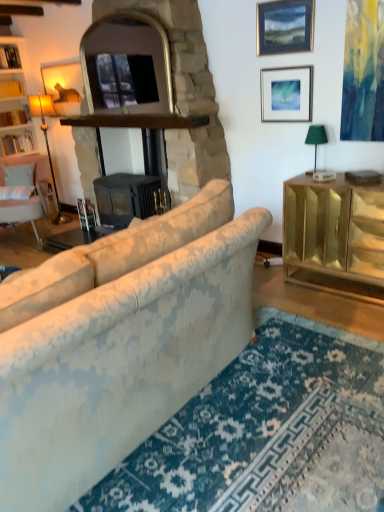
I want to click on light pink fabric chair at left, so click(x=30, y=197).

The width and height of the screenshot is (384, 512). Describe the element at coordinates (315, 141) in the screenshot. I see `green fabric lampshade at right, marked as the 1th lamp in a right-to-left arrangement` at that location.

I want to click on matte gold floor lamp at left, placed as the first lamp when sorted from back to front, so click(47, 145).

What do you see at coordinates (134, 122) in the screenshot?
I see `black matte fireplace at center, the second fireplace from the left` at bounding box center [134, 122].

The image size is (384, 512). What are the coordinates of `gold mirrored cabinet at right` in the screenshot? It's located at (334, 236).

Can you confirm if matte gold floor lamp at left, arranged as the 2th lamp when viewed from the front, is bigger than matte black picture frame at upper center, which ranks as the second picture frame in bottom-to-top order?

Yes.

Consider the image. Between matte gold floor lamp at left, the first lamp from the left, and matte black picture frame at upper center, which is counted as the first picture frame, starting from the top, which one appears on the left side from the viewer's perspective?

Positioned to the left is matte gold floor lamp at left, the first lamp from the left.

From a real-world perspective, which object rests below the other?

matte gold floor lamp at left, placed as the first lamp when sorted from back to front, from a real-world perspective.

In terms of height, does matte gold floor lamp at left, arranged as the 2th lamp when viewed from the front, look taller or shorter compared to matte black picture frame at upper center, which is counted as the first picture frame, starting from the top?

Considering their sizes, matte gold floor lamp at left, arranged as the 2th lamp when viewed from the front, has more height than matte black picture frame at upper center, which is counted as the first picture frame, starting from the top.

Considering the sizes of objects white wood bookshelf at left and stone fireplace at center, acting as the first fireplace starting from the left, in the image provided, who is taller, white wood bookshelf at left or stone fireplace at center, acting as the first fireplace starting from the left,?

Standing taller between the two is stone fireplace at center, acting as the first fireplace starting from the left.

Does white wood bookshelf at left touch stone fireplace at center, acting as the 2th fireplace starting from the right?

No, white wood bookshelf at left is not beside stone fireplace at center, acting as the 2th fireplace starting from the right.

Locate an element on the screen. This screenshot has height=512, width=384. fireplace that is the 2nd one when counting forward from the white wood bookshelf at left is located at coordinates (184, 93).

From the picture: Considering the sizes of objects white wood bookshelf at left and stone fireplace at center, acting as the 2th fireplace starting from the right, in the image provided, who is wider, white wood bookshelf at left or stone fireplace at center, acting as the 2th fireplace starting from the right,?

Wider between the two is stone fireplace at center, acting as the 2th fireplace starting from the right.

From the image's perspective, between gold mirrored cabinet at right and matte gold floor lamp at left, placed as the first lamp when sorted from back to front, who is located below?

gold mirrored cabinet at right, from the image's perspective.

From a real-world perspective, is gold mirrored cabinet at right over matte gold floor lamp at left, placed as the first lamp when sorted from back to front?

No, from a real-world perspective, gold mirrored cabinet at right is not on top of matte gold floor lamp at left, placed as the first lamp when sorted from back to front.

Considering the positions of objects gold mirrored cabinet at right and matte gold floor lamp at left, placed as the first lamp when sorted from back to front, in the image provided, who is more to the left, gold mirrored cabinet at right or matte gold floor lamp at left, placed as the first lamp when sorted from back to front,?

Positioned to the left is matte gold floor lamp at left, placed as the first lamp when sorted from back to front.

Where is `shelf that is under the silver metallic picture frame at upper right, positioned as the 2th picture frame in top-to-bottom order (from a real-world perspective)`? Image resolution: width=384 pixels, height=512 pixels. shelf that is under the silver metallic picture frame at upper right, positioned as the 2th picture frame in top-to-bottom order (from a real-world perspective) is located at coordinates (16, 141).

Is silver metallic picture frame at upper right, acting as the 1th picture frame starting from the bottom, completely or partially inside white wood bookshelf at left?

Definitely not — silver metallic picture frame at upper right, acting as the 1th picture frame starting from the bottom, is not inside white wood bookshelf at left.

From a real-world perspective, who is located higher, white wood bookshelf at left or silver metallic picture frame at upper right, acting as the 1th picture frame starting from the bottom?

In real-world perspective, silver metallic picture frame at upper right, acting as the 1th picture frame starting from the bottom, is above.

Does white wood bookshelf at left have a smaller size compared to silver metallic picture frame at upper right, positioned as the 2th picture frame in top-to-bottom order?

Incorrect, white wood bookshelf at left is not smaller in size than silver metallic picture frame at upper right, positioned as the 2th picture frame in top-to-bottom order.

From the image's perspective, which is below, black matte fireplace at center, which appears as the first fireplace when viewed from the right, or matte gold floor lamp at left, placed as the first lamp when sorted from back to front?

black matte fireplace at center, which appears as the first fireplace when viewed from the right, appears lower in the image.

From a real-world perspective, is black matte fireplace at center, the second fireplace from the left, above or below matte gold floor lamp at left, placed as the first lamp when sorted from back to front?

Clearly, from a real-world perspective, black matte fireplace at center, the second fireplace from the left, is below matte gold floor lamp at left, placed as the first lamp when sorted from back to front.

How many degrees apart are the facing directions of black matte fireplace at center, the second fireplace from the left, and matte gold floor lamp at left, the first lamp from the left?

The angle between the facing direction of black matte fireplace at center, the second fireplace from the left, and the facing direction of matte gold floor lamp at left, the first lamp from the left, is 3.88 degrees.

Can we say black matte fireplace at center, which appears as the first fireplace when viewed from the right, lies outside matte gold floor lamp at left, arranged as the 2th lamp when viewed from the front?

Indeed, black matte fireplace at center, which appears as the first fireplace when viewed from the right, is completely outside matte gold floor lamp at left, arranged as the 2th lamp when viewed from the front.

Based on the photo, who is smaller, stone fireplace at center, acting as the 2th fireplace starting from the right, or black matte fireplace at center, the second fireplace from the left?

black matte fireplace at center, the second fireplace from the left, is smaller.

From a real-world perspective, is stone fireplace at center, acting as the 2th fireplace starting from the right, positioned under black matte fireplace at center, the second fireplace from the left, based on gravity?

No, from a real-world perspective, stone fireplace at center, acting as the 2th fireplace starting from the right, is not beneath black matte fireplace at center, the second fireplace from the left.

Find the location of `fireplace that appears below the stone fireplace at center, acting as the 2th fireplace starting from the right (from a real-world perspective)`. fireplace that appears below the stone fireplace at center, acting as the 2th fireplace starting from the right (from a real-world perspective) is located at coordinates (134, 122).

Does matte black picture frame at upper center, which is counted as the first picture frame, starting from the top, have a lesser height compared to stone fireplace at center, acting as the first fireplace starting from the left?

Indeed, matte black picture frame at upper center, which is counted as the first picture frame, starting from the top, has a lesser height compared to stone fireplace at center, acting as the first fireplace starting from the left.

Does matte black picture frame at upper center, which ranks as the second picture frame in bottom-to-top order, have a larger size compared to stone fireplace at center, acting as the 2th fireplace starting from the right?

Incorrect, matte black picture frame at upper center, which ranks as the second picture frame in bottom-to-top order, is not larger than stone fireplace at center, acting as the 2th fireplace starting from the right.

Would you say stone fireplace at center, acting as the 2th fireplace starting from the right, is part of matte black picture frame at upper center, which ranks as the second picture frame in bottom-to-top order,'s contents?

No, stone fireplace at center, acting as the 2th fireplace starting from the right, is located outside of matte black picture frame at upper center, which ranks as the second picture frame in bottom-to-top order.

How different are the orientations of matte black picture frame at upper center, which ranks as the second picture frame in bottom-to-top order, and stone fireplace at center, acting as the 2th fireplace starting from the right, in degrees?

1.06 degrees.

I want to click on lamp lying on the left of matte black picture frame at upper center, which is counted as the first picture frame, starting from the top, so click(47, 145).

The image size is (384, 512). I want to click on shelf located underneath the stone fireplace at center, acting as the 2th fireplace starting from the right (from a real-world perspective), so click(16, 141).

When comparing their distances from black matte fireplace at center, the second fireplace from the left, does green fabric lampshade at right, which appears as the second lamp when viewed from the left, or matte gold floor lamp at left, placed as the first lamp when sorted from back to front, seem further?

matte gold floor lamp at left, placed as the first lamp when sorted from back to front, is positioned further to the anchor black matte fireplace at center, the second fireplace from the left.

Looking at the image, which one is located further to black matte fireplace at center, the second fireplace from the left, green fabric lampshade at right, marked as the 1th lamp in a right-to-left arrangement, or stone fireplace at center, acting as the 2th fireplace starting from the right?

green fabric lampshade at right, marked as the 1th lamp in a right-to-left arrangement, is positioned further to the anchor black matte fireplace at center, the second fireplace from the left.

In the scene shown: When comparing their distances from gold mirrored cabinet at right, does matte gold floor lamp at left, the first lamp from the left, or matte black picture frame at upper center, which is counted as the first picture frame, starting from the top, seem closer?

matte black picture frame at upper center, which is counted as the first picture frame, starting from the top, lies closer to gold mirrored cabinet at right than the other object.

Estimate the real-world distances between objects in this image. Which object is further from matte black picture frame at upper center, which ranks as the second picture frame in bottom-to-top order, floral fabric sofa at center or black matte fireplace at center, the second fireplace from the left?

The object further to matte black picture frame at upper center, which ranks as the second picture frame in bottom-to-top order, is floral fabric sofa at center.

Looking at the image, which one is located further to matte gold floor lamp at left, the first lamp from the left, light pink fabric chair at left or silver metallic picture frame at upper right, acting as the 1th picture frame starting from the bottom?

silver metallic picture frame at upper right, acting as the 1th picture frame starting from the bottom, is positioned further to the anchor matte gold floor lamp at left, the first lamp from the left.

Looking at the image, which one is located further to light pink fabric chair at left, green fabric lampshade at right, the 1th lamp viewed from the front, or floral fabric sofa at center?

floral fabric sofa at center.

When comparing their distances from light pink fabric chair at left, does silver metallic picture frame at upper right, positioned as the 2th picture frame in top-to-bottom order, or matte black picture frame at upper center, which is counted as the first picture frame, starting from the top, seem further?

matte black picture frame at upper center, which is counted as the first picture frame, starting from the top, lies further to light pink fabric chair at left than the other object.

Looking at the image, which one is located closer to matte gold floor lamp at left, which appears as the 2th lamp when viewed from the right, matte black picture frame at upper center, which is counted as the first picture frame, starting from the top, or black matte fireplace at center, which appears as the first fireplace when viewed from the right?

Based on the image, black matte fireplace at center, which appears as the first fireplace when viewed from the right, appears to be nearer to matte gold floor lamp at left, which appears as the 2th lamp when viewed from the right.

You are a GUI agent. You are given a task and a screenshot of the screen. Output one action in this format:
    pyautogui.click(x=<x>, y=<y>)
    Task: Click on the picture frame located between white wood bookshelf at left and silver metallic picture frame at upper right, acting as the 1th picture frame starting from the bottom, in the left-right direction
    Image resolution: width=384 pixels, height=512 pixels.
    Given the screenshot: What is the action you would take?
    pyautogui.click(x=285, y=26)

I want to click on fireplace between stone fireplace at center, acting as the first fireplace starting from the left, and silver metallic picture frame at upper right, positioned as the 2th picture frame in top-to-bottom order, in the horizontal direction, so click(134, 122).

Locate an element on the screen. lamp positioned between floral fabric sofa at center and matte gold floor lamp at left, the first lamp from the left, from near to far is located at coordinates (315, 141).

Identify the location of lamp between matte gold floor lamp at left, the first lamp from the left, and gold mirrored cabinet at right from left to right. The image size is (384, 512). (315, 141).